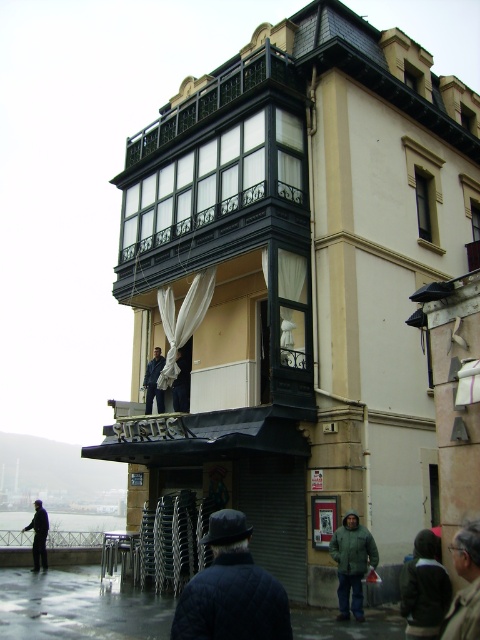
Is point (470, 522) closer to viewer compared to point (43, 556)?

Yes, point (470, 522) is in front of point (43, 556).

Is point (450, 624) positioned behind point (41, 552)?

No, (450, 624) is closer to viewer.

What do you see at coordinates (467, 586) in the screenshot?
I see `dark gray knit cap at lower right` at bounding box center [467, 586].

Locate an element on the screen. dark gray knit cap at lower right is located at coordinates (467, 586).

Which is more to the right, dark blue woolen coat at lower center or dark blue jacket at center?

dark blue woolen coat at lower center

Is dark blue woolen coat at lower center to the left of dark blue jacket at center from the viewer's perspective?

No, dark blue woolen coat at lower center is not to the left of dark blue jacket at center.

Which is behind, point (261, 620) or point (156, 385)?

The point (156, 385) is behind.

Locate an element on the screen. dark blue woolen coat at lower center is located at coordinates (230, 589).

Which is more to the right, dark blue jacket at lower left or dark blue jacket at center?

dark blue jacket at center

Is point (47, 513) in front of point (159, 371)?

No.

This screenshot has height=640, width=480. What do you see at coordinates (38, 536) in the screenshot?
I see `dark blue jacket at lower left` at bounding box center [38, 536].

Where is `dark blue jacket at lower left`? dark blue jacket at lower left is located at coordinates (38, 536).